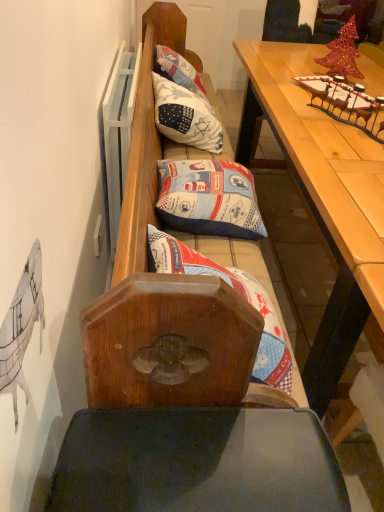
Question: From a real-world perspective, is white fabric pillow at center, the 3th pillow ordered from the bottom, physically located above or below printed fabric pillow at center, which is counted as the 1th pillow, starting from the front?

Choices:
 (A) below
 (B) above

Answer: (A)

Question: In terms of width, does white fabric pillow at center, positioned as the third pillow in front-to-back order, look wider or thinner when compared to printed fabric pillow at center, which is counted as the 1th pillow, starting from the front?

Choices:
 (A) wide
 (B) thin

Answer: (B)

Question: Estimate the real-world distances between objects in this image. Which object is closer to the printed fabric pillow at center, which is the 1th pillow from bottom to top?

Choices:
 (A) wooden table at upper right
 (B) white fabric pillow at center, the 1th pillow from the top
 (C) blue fabric pillow at center, placed as the 2th pillow when sorted from bottom to top

Answer: (C)

Question: Based on their relative distances, which object is nearer to the printed fabric pillow at center, arranged as the 3th pillow when viewed from the top?

Choices:
 (A) blue fabric pillow at center, which appears as the second pillow when viewed from the front
 (B) white fabric pillow at center, the 1th pillow from the top
 (C) wooden table at upper right

Answer: (A)